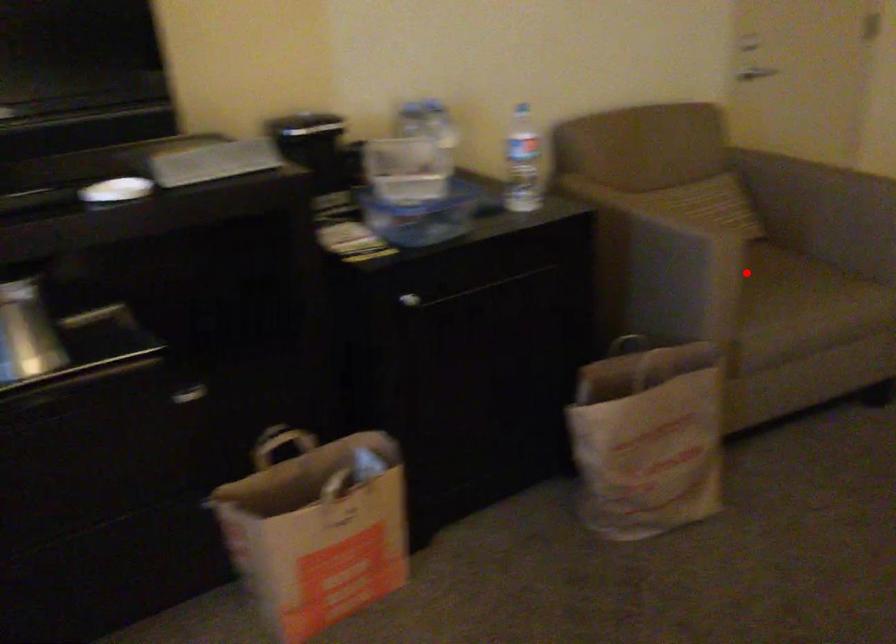
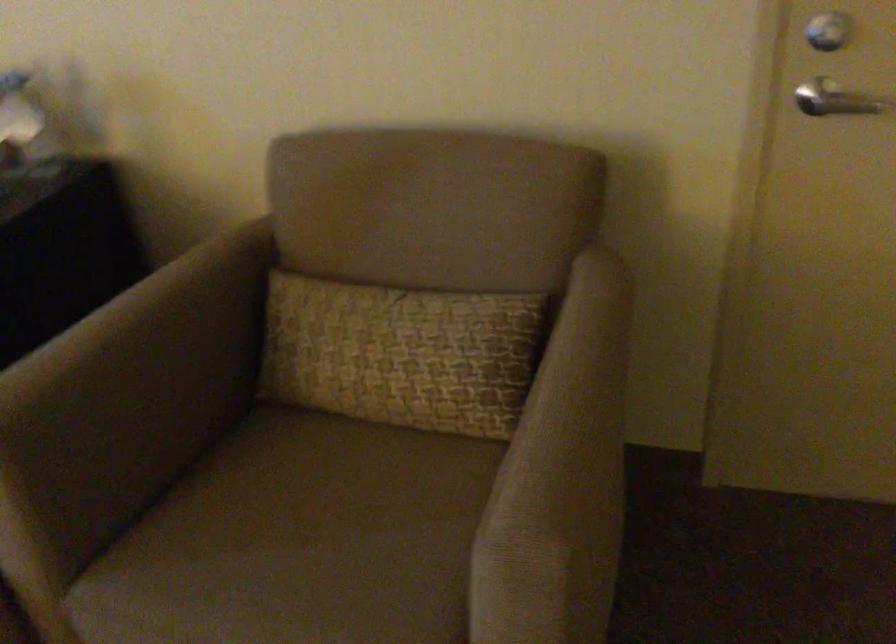
Question: I am providing you with two images of the same scene from different viewpoints. A red point is marked on the first image. Is the red point's position out of view in image 2?

Choices:
 (A) Yes
 (B) No

Answer: (B)